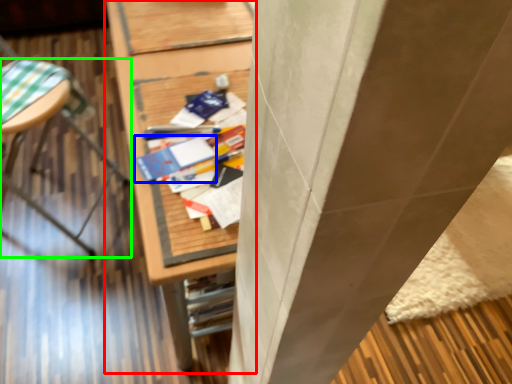
Question: Based on their relative distances, which object is farther from furniture (highlighted by a red box)? Choose from paperback book (highlighted by a blue box) and furniture (highlighted by a green box).

Choices:
 (A) paperback book
 (B) furniture

Answer: (B)